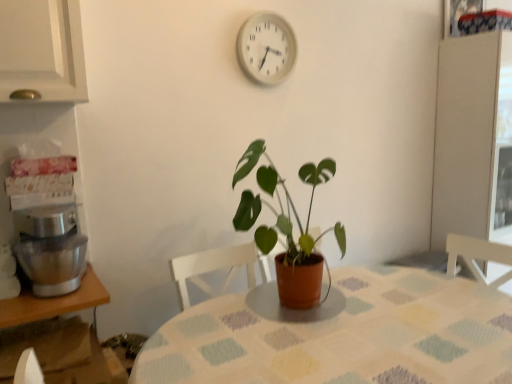
You are a GUI agent. You are given a task and a screenshot of the screen. Output one action in this format:
    pyautogui.click(x=<x>, y=<y>)
    Task: Click on the free spot to the right of green matte plant at center
    
    Given the screenshot: What is the action you would take?
    pyautogui.click(x=385, y=301)